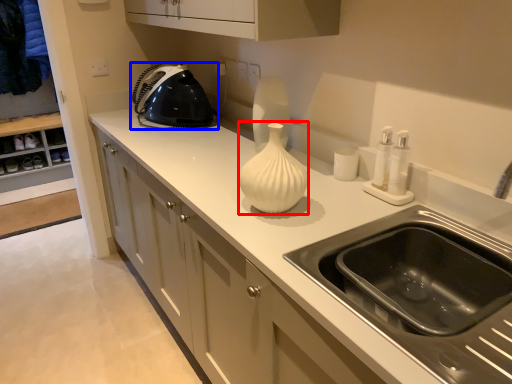
Question: Which object appears closest to the camera in this image, vase (highlighted by a red box) or home appliance (highlighted by a blue box)?

Choices:
 (A) vase
 (B) home appliance

Answer: (A)